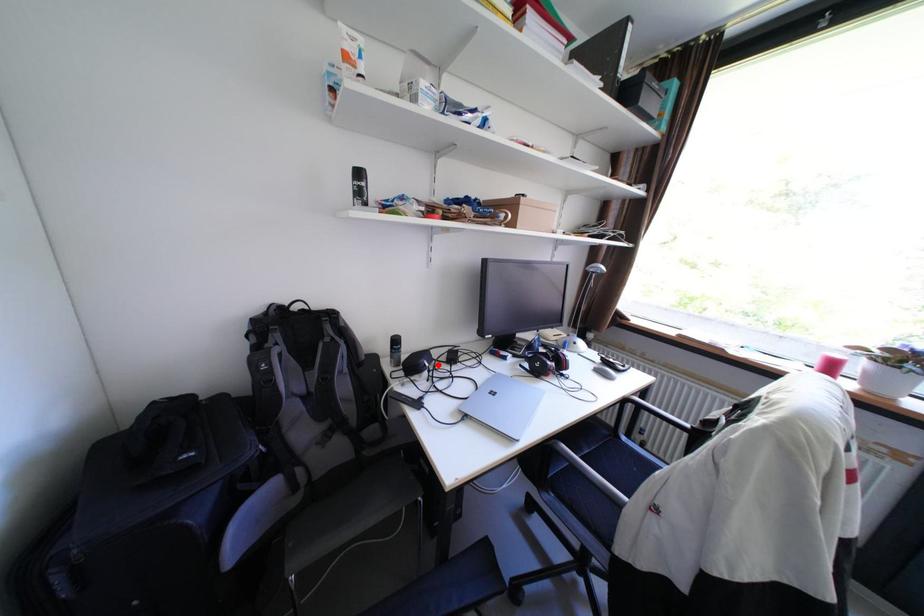
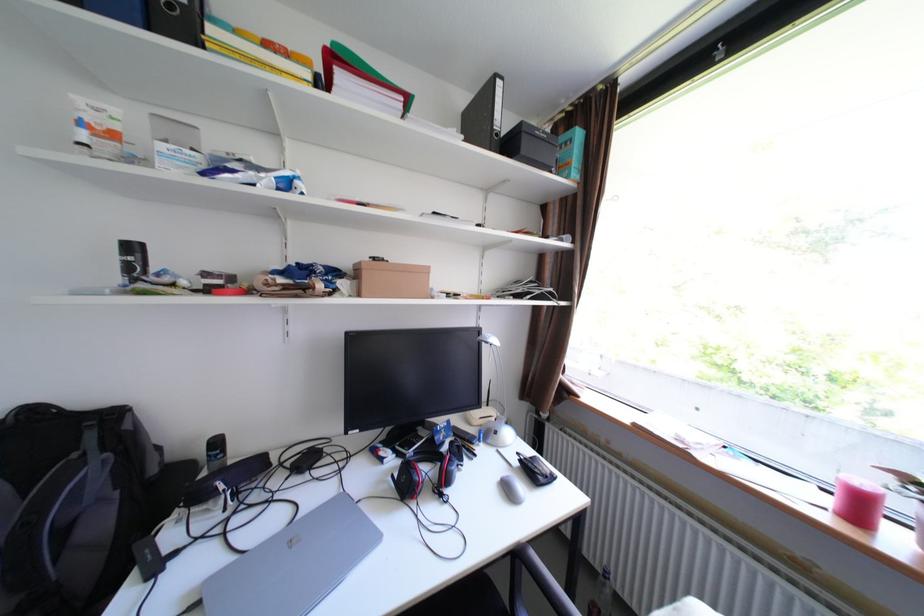
Question: I am providing you with two images of the same scene from different viewpoints. A red point is marked on the first image. Can you still see the location of the red point in image 2?

Choices:
 (A) Yes
 (B) No

Answer: (A)